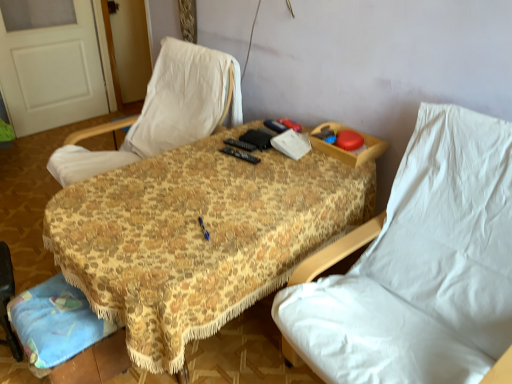
Question: Based on their sizes in the image, would you say white fabric chair at center, which ranks as the 1th chair in left-to-right order, is bigger or smaller than white fabric chair at right, the second chair viewed from the left?

Choices:
 (A) small
 (B) big

Answer: (A)

Question: Is point (163, 135) closer or farther from the camera than point (443, 208)?

Choices:
 (A) farther
 (B) closer

Answer: (A)

Question: Considering the real-world distances, which object is closest to the white fabric chair at center, the 2th chair when ordered from right to left?

Choices:
 (A) white matte door at upper left
 (B) floral fabric table at center
 (C) white fabric chair at right, positioned as the first chair in right-to-left order

Answer: (B)

Question: Which object is the closest to the white fabric chair at right, the second chair viewed from the left?

Choices:
 (A) white fabric chair at center, the 2th chair when ordered from right to left
 (B) white matte door at upper left
 (C) floral fabric table at center

Answer: (C)